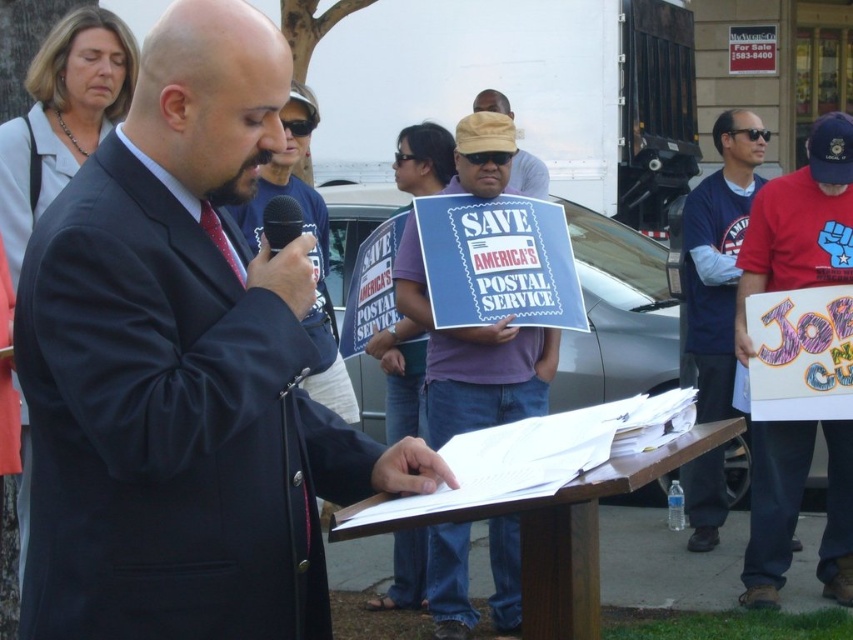
Question: Can you confirm if blue fabric sign at center is bigger than tan straw hat at center?

Choices:
 (A) yes
 (B) no

Answer: (A)

Question: Does matte black suit at center appear under red cotton shirt at right?

Choices:
 (A) no
 (B) yes

Answer: (A)

Question: Among these objects, which one is farthest from the camera?

Choices:
 (A) black matte microphone at center
 (B) matte black suit at center
 (C) blue fabric sign at center

Answer: (C)

Question: Is tan straw hat at center wider than black matte microphone at center?

Choices:
 (A) no
 (B) yes

Answer: (B)

Question: Among these points, which one is nearest to the camera?

Choices:
 (A) (316, 291)
 (B) (722, 266)
 (C) (786, 202)

Answer: (A)

Question: Which of these objects is positioned farthest from the blue fabric sign at center?

Choices:
 (A) black matte microphone at center
 (B) blue jersey at right
 (C) tan straw hat at center
 (D) matte black suit at center

Answer: (C)